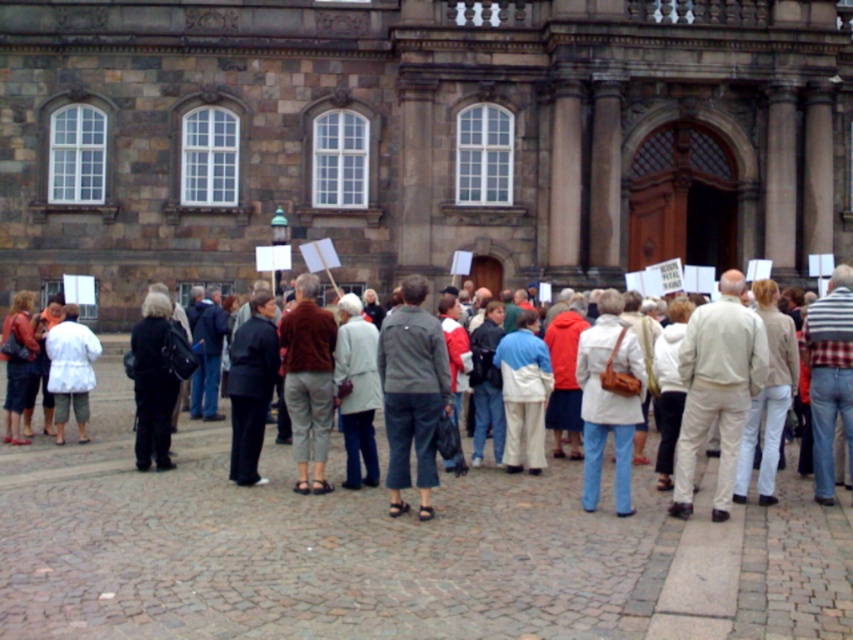
Is beige cotton pants at right wider than white matte jacket at lower left?

Correct, the width of beige cotton pants at right exceeds that of white matte jacket at lower left.

Does beige cotton pants at right have a greater height compared to white matte jacket at lower left?

Correct, beige cotton pants at right is much taller as white matte jacket at lower left.

Find the location of a particular element. The height and width of the screenshot is (640, 853). beige cotton pants at right is located at coordinates (717, 388).

Is gray fabric jacket at center to the right of white matte jacket at lower left from the viewer's perspective?

Yes, gray fabric jacket at center is to the right of white matte jacket at lower left.

Can you confirm if gray fabric jacket at center is wider than white matte jacket at lower left?

Correct, the width of gray fabric jacket at center exceeds that of white matte jacket at lower left.

Between point (432, 352) and point (62, 374), which one is positioned behind?

Point (62, 374)

Locate an element on the screen. This screenshot has width=853, height=640. gray fabric jacket at center is located at coordinates (412, 394).

Which is in front, point (686, 396) or point (422, 486)?

Point (422, 486) is more forward.

Does beige cotton pants at right have a lesser width compared to gray fabric jacket at center?

No, beige cotton pants at right is not thinner than gray fabric jacket at center.

You are a GUI agent. You are given a task and a screenshot of the screen. Output one action in this format:
    pyautogui.click(x=<x>, y=<y>)
    Task: Click on the beige cotton pants at right
    
    Given the screenshot: What is the action you would take?
    pyautogui.click(x=717, y=388)